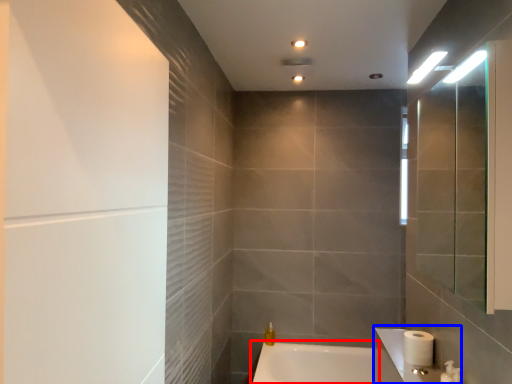
Question: Which of the following is the closest to the observer, bathtub (highlighted by a red box) or sink (highlighted by a blue box)?

Choices:
 (A) bathtub
 (B) sink

Answer: (B)